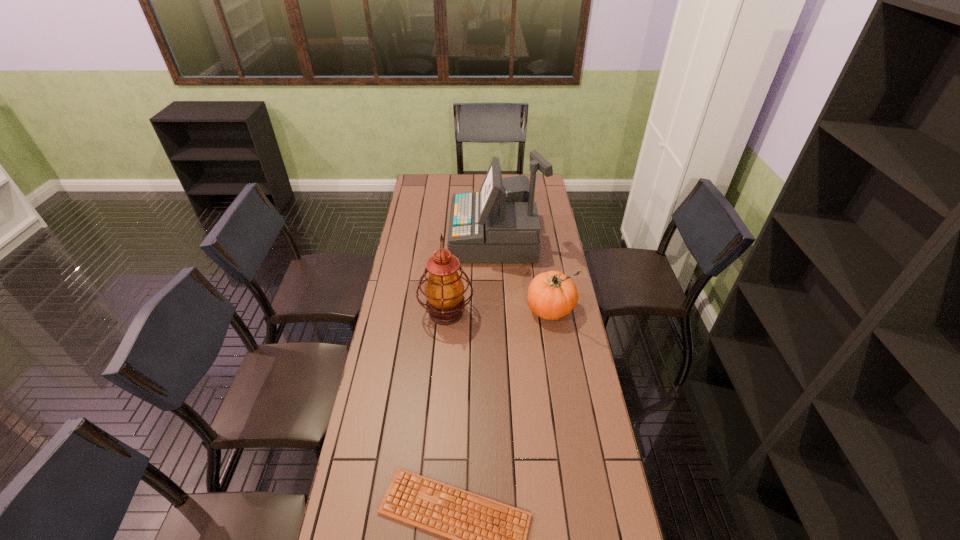
Identify the location of the farthest object. The width and height of the screenshot is (960, 540). (499, 224).

This screenshot has height=540, width=960. What are the coordinates of `the third shortest object` in the screenshot? It's located at (444, 290).

This screenshot has height=540, width=960. In order to click on pumpkin in this screenshot , I will do `click(551, 295)`.

The height and width of the screenshot is (540, 960). In order to click on vacant space located 0.230m on the customer-facing side of the cash register in this screenshot , I will do `click(403, 238)`.

This screenshot has height=540, width=960. I want to click on vacant region located on the customer-facing side of the cash register, so click(x=401, y=238).

The height and width of the screenshot is (540, 960). Find the location of `free region located 0.220m on the customer-facing side of the cash register`. free region located 0.220m on the customer-facing side of the cash register is located at coordinates (405, 238).

I want to click on vacant space positioned on the right of the oil lamp, so click(506, 313).

In order to click on blank space located 0.350m on the left of the pumpkin in this screenshot , I will do `click(441, 308)`.

The height and width of the screenshot is (540, 960). In order to click on object present at the left edge in this screenshot , I will do `click(444, 290)`.

You are a GUI agent. You are given a task and a screenshot of the screen. Output one action in this format:
    pyautogui.click(x=<x>, y=<y>)
    Task: Click on the cash register positioned at the right edge
    
    Given the screenshot: What is the action you would take?
    pyautogui.click(x=499, y=224)